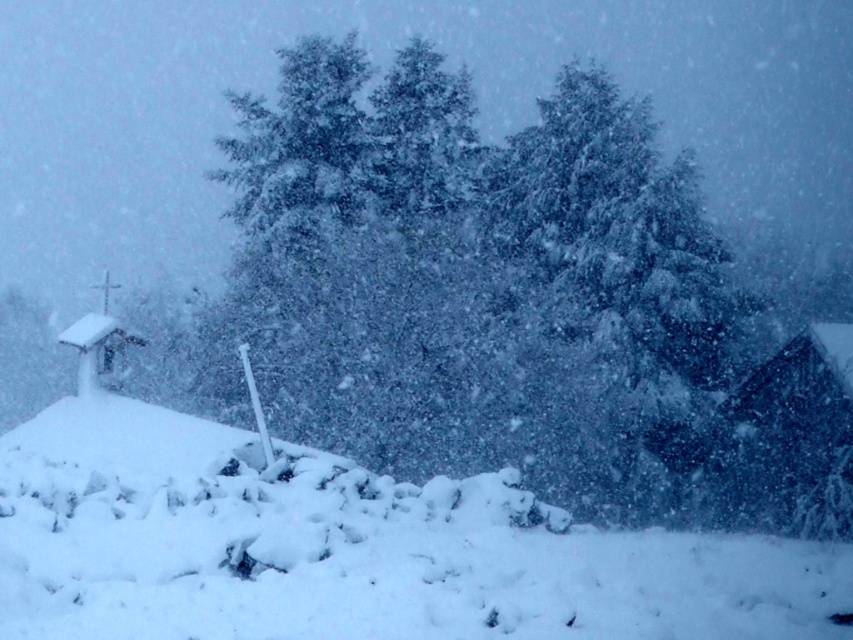
Question: Which point is closer to the camera?

Choices:
 (A) (782, 365)
 (B) (425, 593)

Answer: (B)

Question: Which point is farther from the camera taking this photo?

Choices:
 (A) (824, 525)
 (B) (656, 582)

Answer: (A)

Question: Does white fluffy snow at lower center appear on the right side of wooden cabin at right?

Choices:
 (A) yes
 (B) no

Answer: (B)

Question: Is white fluffy snow at lower center to the left of wooden cabin at right from the viewer's perspective?

Choices:
 (A) no
 (B) yes

Answer: (B)

Question: Can you confirm if white fluffy snow at lower center is wider than wooden cabin at right?

Choices:
 (A) yes
 (B) no

Answer: (A)